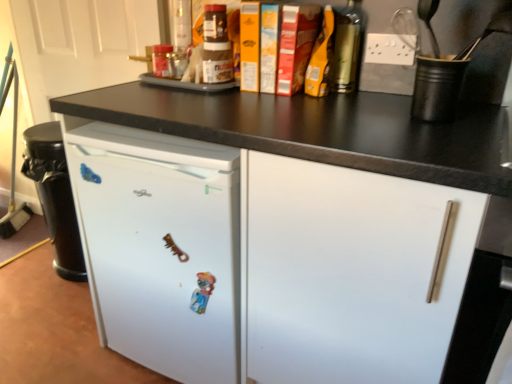
Question: Can you confirm if white matte drawer at center is shorter than metallic gold bottle at upper right, placed as the 2th bottle when sorted from back to front?

Choices:
 (A) no
 (B) yes

Answer: (A)

Question: Would you say white matte drawer at center is outside metallic gold bottle at upper right, which is the first bottle from front to back?

Choices:
 (A) no
 (B) yes

Answer: (B)

Question: Is white matte drawer at center facing towards metallic gold bottle at upper right, which is the first bottle from front to back?

Choices:
 (A) yes
 (B) no

Answer: (B)

Question: Is white matte drawer at center further to camera compared to metallic gold bottle at upper right, placed as the 2th bottle when sorted from back to front?

Choices:
 (A) yes
 (B) no

Answer: (B)

Question: Is white matte drawer at center oriented away from metallic gold bottle at upper right, placed as the 2th bottle when sorted from back to front?

Choices:
 (A) no
 (B) yes

Answer: (A)

Question: From the image's perspective, is white matte door at upper left above or below translucent plastic jar at upper center, the 2th bottle viewed from the right?

Choices:
 (A) above
 (B) below

Answer: (A)

Question: Looking at the image, does white matte door at upper left seem bigger or smaller compared to translucent plastic jar at upper center, which is the first bottle from back to front?

Choices:
 (A) small
 (B) big

Answer: (B)

Question: Looking at their shapes, would you say white matte door at upper left is wider or thinner than translucent plastic jar at upper center, which is the first bottle from back to front?

Choices:
 (A) thin
 (B) wide

Answer: (A)

Question: From a real-world perspective, is white matte door at upper left positioned above or below translucent plastic jar at upper center, marked as the 2th bottle in a front-to-back arrangement?

Choices:
 (A) below
 (B) above

Answer: (A)

Question: Looking at their shapes, would you say white matte refrigerator at center is wider or thinner than black matte cup at upper right?

Choices:
 (A) wide
 (B) thin

Answer: (A)

Question: From a real-world perspective, relative to black matte cup at upper right, is white matte refrigerator at center vertically above or below?

Choices:
 (A) below
 (B) above

Answer: (A)

Question: Considering the positions of white matte refrigerator at center and black matte cup at upper right in the image, is white matte refrigerator at center bigger or smaller than black matte cup at upper right?

Choices:
 (A) big
 (B) small

Answer: (A)

Question: Is white matte refrigerator at center situated inside black matte cup at upper right or outside?

Choices:
 (A) inside
 (B) outside

Answer: (B)

Question: From their relative heights in the image, would you say white matte drawer at center is taller or shorter than metallic gold bottle at upper right, which is counted as the second bottle, starting from the left?

Choices:
 (A) short
 (B) tall

Answer: (B)

Question: Would you say white matte drawer at center is to the left or to the right of metallic gold bottle at upper right, the first bottle when ordered from right to left, in the picture?

Choices:
 (A) left
 (B) right

Answer: (B)